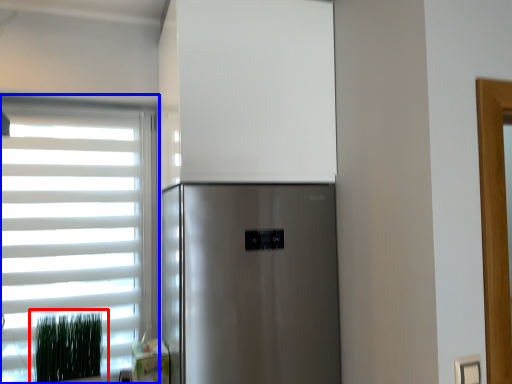
Question: Which object is closer to the camera taking this photo, plant (highlighted by a red box) or window (highlighted by a blue box)?

Choices:
 (A) plant
 (B) window

Answer: (A)